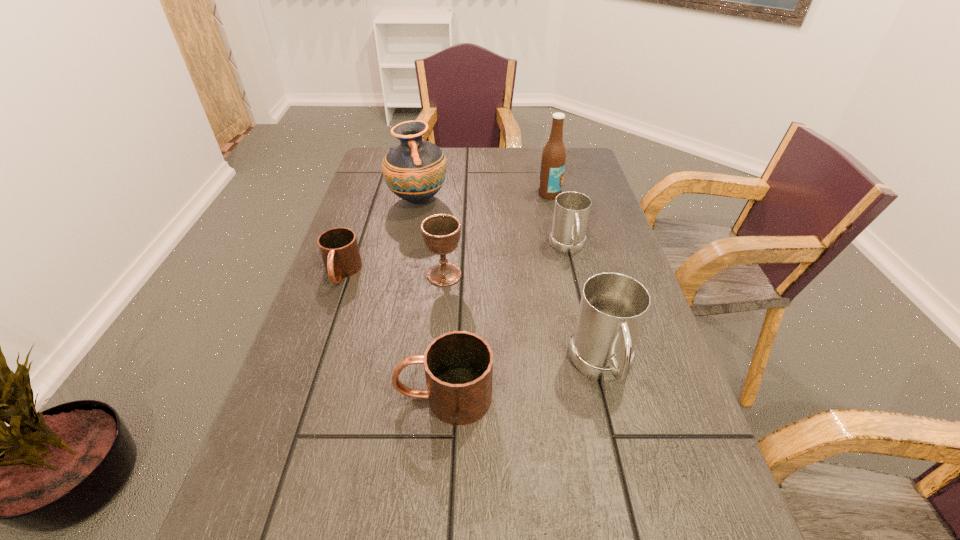
Locate an element on the screen. vacant space situated on the front of the beer bottle is located at coordinates (563, 252).

In order to click on vacant area situated 0.300m on the front of the pottery in this screenshot , I will do `click(401, 289)`.

At what (x,y) coordinates should I click in order to perform the action: click on free space located 0.160m on the side of the nearer gray mug with the handle. Please return your answer as a coordinate pair (x, y). Image resolution: width=960 pixels, height=540 pixels. Looking at the image, I should click on (x=635, y=497).

At what (x,y) coordinates should I click in order to perform the action: click on free space located on the right of the chalice. Please return your answer as a coordinate pair (x, y). Image resolution: width=960 pixels, height=540 pixels. Looking at the image, I should click on [540, 275].

Identify the location of free space located on the side of the smaller gray mug with the handle. (578, 288).

Locate an element on the screen. The height and width of the screenshot is (540, 960). blank area located on the side of the third mug from right to left with the handle is located at coordinates (300, 397).

This screenshot has height=540, width=960. I want to click on vacant space situated on the side of the third mug from right to left with the handle, so click(331, 397).

At what (x,y) coordinates should I click in order to perform the action: click on vacant area situated on the side of the third mug from right to left with the handle. Please return your answer as a coordinate pair (x, y). This screenshot has height=540, width=960. Looking at the image, I should click on (326, 397).

Locate an element on the screen. The height and width of the screenshot is (540, 960). vacant space situated 0.340m on the side of the leftmost mug with the handle is located at coordinates (289, 424).

Find the location of a particular element. pottery that is at the left edge is located at coordinates (415, 170).